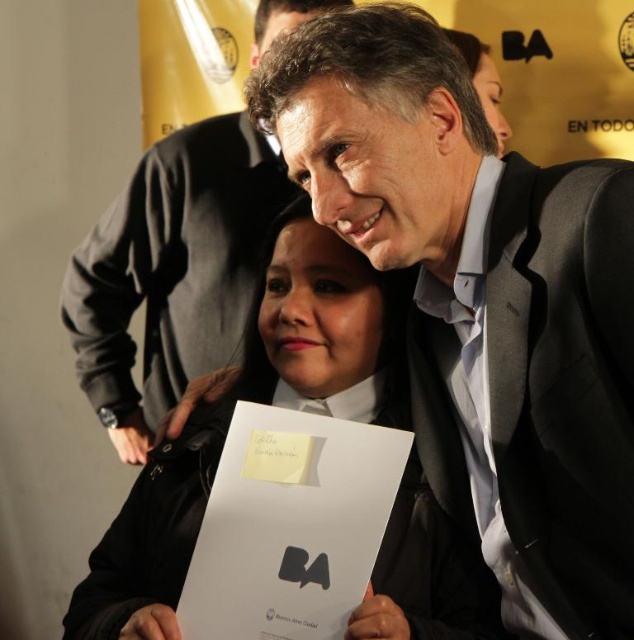
Can you confirm if dark gray suit at center is smaller than matte black suit at center?

Yes, dark gray suit at center is smaller than matte black suit at center.

Consider the image. Is dark gray suit at center shorter than matte black suit at center?

Yes, dark gray suit at center is shorter than matte black suit at center.

Locate an element on the screen. dark gray suit at center is located at coordinates (536, 392).

Who is taller, dark gray suit at center or matte black jacket at center?

With more height is dark gray suit at center.

Is dark gray suit at center to the left of matte black jacket at center from the viewer's perspective?

In fact, dark gray suit at center is to the right of matte black jacket at center.

Locate an element on the screen. This screenshot has width=634, height=640. dark gray suit at center is located at coordinates 536,392.

The width and height of the screenshot is (634, 640). I want to click on dark gray suit at center, so click(x=536, y=392).

Who is positioned more to the left, black suit at center or matte black suit at center?

From the viewer's perspective, matte black suit at center appears more on the left side.

Between point (602, 605) and point (139, 216), which one is positioned behind?

The point (139, 216) is more distant.

I want to click on black suit at center, so click(482, 301).